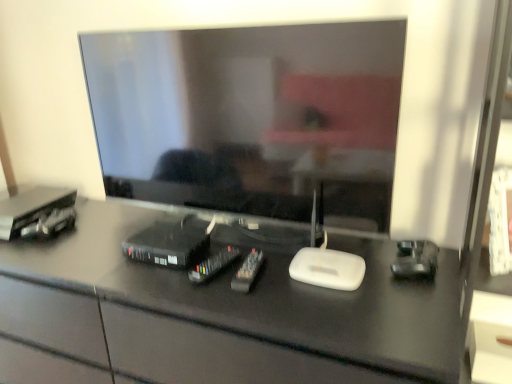
Question: Considering the relative positions of black plastic remote controls at center, the 1th equipment when ordered from right to left, and metallic black cable box at left, placed as the 4th equipment when sorted from right to left, in the image provided, is black plastic remote controls at center, the 1th equipment when ordered from right to left, to the left or to the right of metallic black cable box at left, placed as the 4th equipment when sorted from right to left,?

Choices:
 (A) right
 (B) left

Answer: (A)

Question: From the image's perspective, is black plastic remote controls at center, the 1th equipment when ordered from right to left, above or below metallic black cable box at left, marked as the first equipment in a left-to-right arrangement?

Choices:
 (A) above
 (B) below

Answer: (B)

Question: Estimate the real-world distances between objects in this image. Which object is farther from the black plastic remote control at center, the second equipment viewed from the right?

Choices:
 (A) black glossy desk at center
 (B) matte white drawer at lower right
 (C) black plastic remote controls at center, the 1th equipment when ordered from right to left
 (D) matte black television at center
 (E) metallic black cable box at left, placed as the 4th equipment when sorted from right to left

Answer: (B)

Question: Which object is the farthest from the black glossy desk at center?

Choices:
 (A) black plastic remote controls at center, the 4th equipment when ordered from left to right
 (B) matte white drawer at lower right
 (C) matte black television at center
 (D) black plastic remote control at center, the second equipment viewed from the right
 (E) metallic black cable box at left, placed as the 4th equipment when sorted from right to left

Answer: (B)